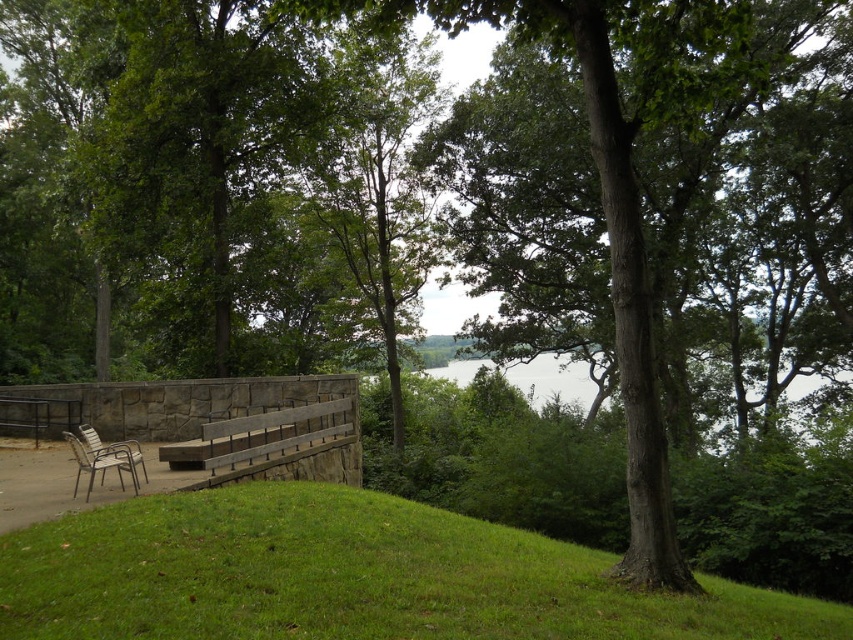
Question: Can you confirm if green rough bark tree at center is positioned to the right of brown wooden bench at center?

Choices:
 (A) no
 (B) yes

Answer: (B)

Question: Does green rough bark tree at center have a smaller size compared to brown wooden bench at center?

Choices:
 (A) no
 (B) yes

Answer: (A)

Question: Which is nearer to the brown wooden bench at center?

Choices:
 (A) green grassy hillside at lower left
 (B) green rough bark tree at center

Answer: (A)

Question: Is green rough bark tree at center positioned before metallic silver chair at lower left?

Choices:
 (A) yes
 (B) no

Answer: (A)

Question: Which object is closer to the camera taking this photo?

Choices:
 (A) brown wooden bench at center
 (B) green grassy hillside at lower left
 (C) metallic silver chair at lower left

Answer: (B)

Question: Among these points, which one is farthest from the camera?

Choices:
 (A) (225, 452)
 (B) (450, 525)
 (C) (506, 116)

Answer: (C)